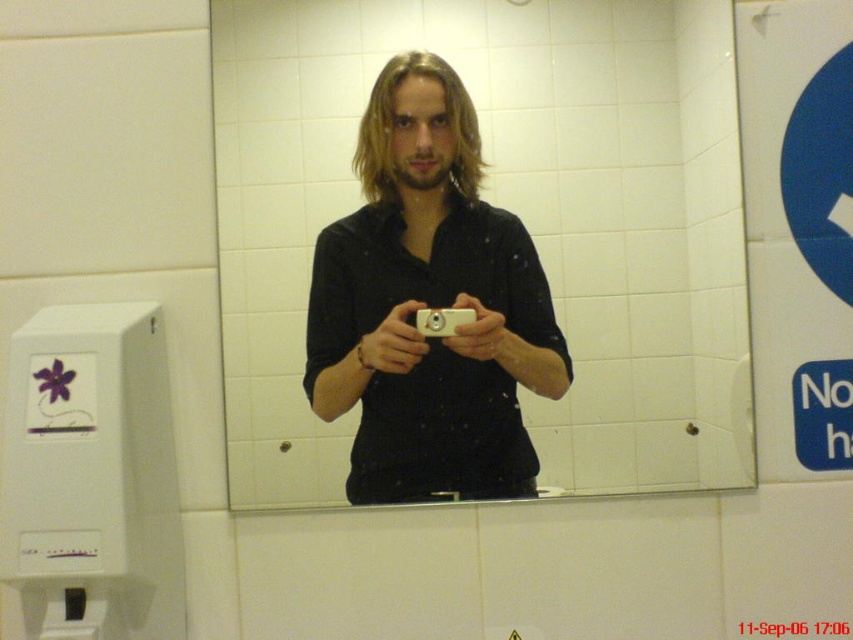
Is white glossy mirror at center thinner than white plastic camera at center?

No.

Is white glossy mirror at center bigger than white plastic camera at center?

Yes.

Who is more forward, (281, 266) or (421, 317)?

Positioned in front is point (421, 317).

Locate an element on the screen. Image resolution: width=853 pixels, height=640 pixels. white glossy mirror at center is located at coordinates (508, 209).

From the picture: Can you confirm if white glossy mirror at center is shorter than matte black camera at center?

No, white glossy mirror at center is not shorter than matte black camera at center.

Which is above, white glossy mirror at center or matte black camera at center?

white glossy mirror at center is above.

Where is `white glossy mirror at center`? This screenshot has height=640, width=853. white glossy mirror at center is located at coordinates (508, 209).

Locate an element on the screen. The height and width of the screenshot is (640, 853). white glossy mirror at center is located at coordinates (508, 209).

Which is more to the left, matte black camera at center or white plastic camera at center?

Positioned to the left is matte black camera at center.

Which is in front, point (515, 436) or point (428, 324)?

Point (428, 324)

Who is more distant from viewer, (418, 376) or (450, 321)?

The point (418, 376) is more distant.

The height and width of the screenshot is (640, 853). Identify the location of matte black camera at center. (428, 305).